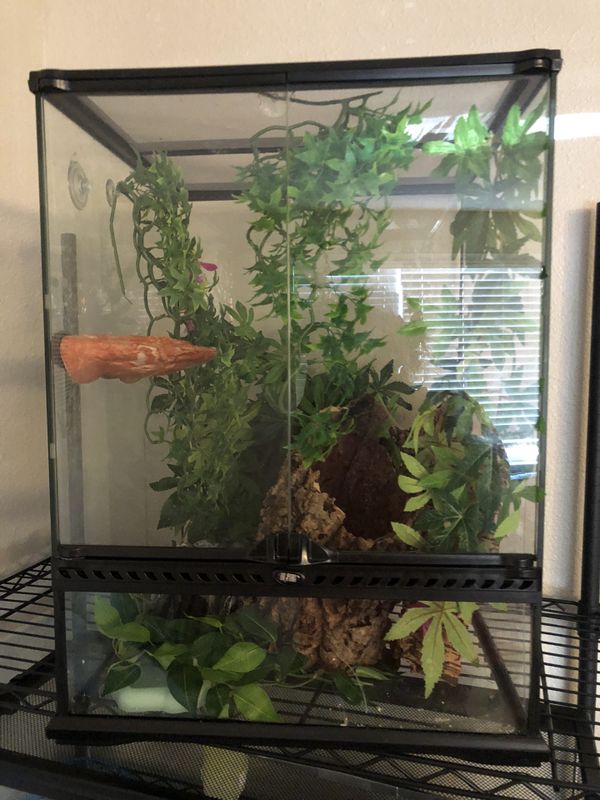
This screenshot has height=800, width=600. I want to click on gap between the aquarium doors, so click(285, 80).